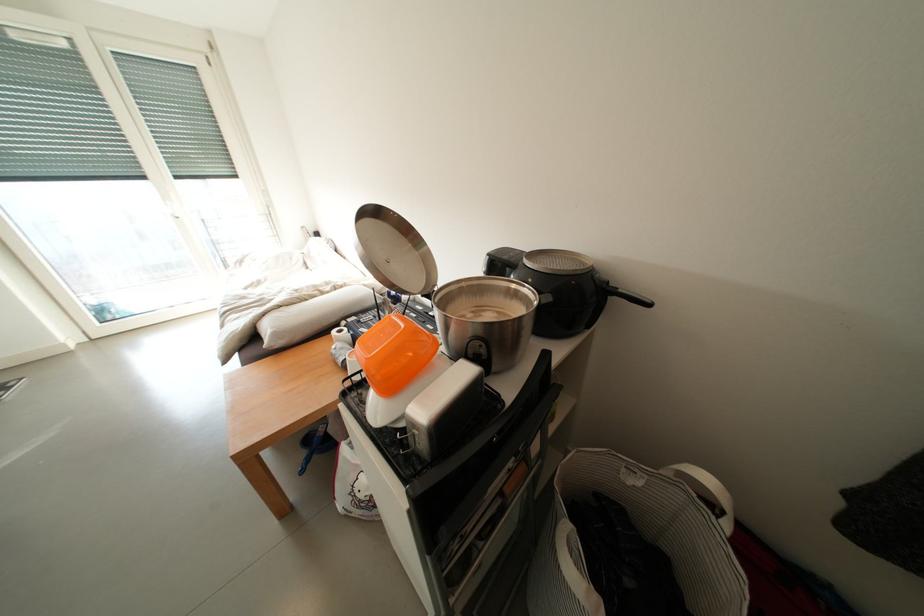
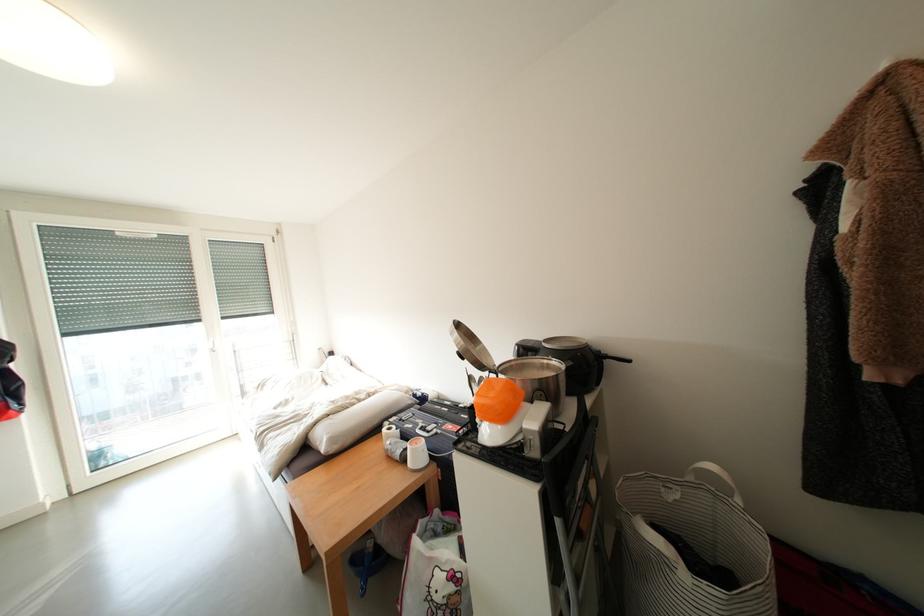
The point at (341, 323) is marked in the first image. Where is the corresponding point in the second image?

(383, 426)